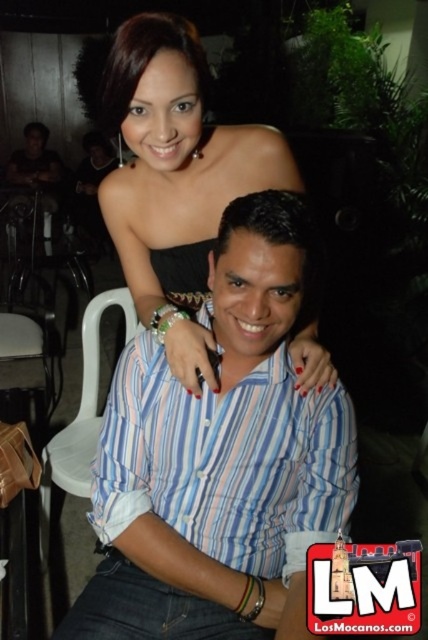
Question: Estimate the real-world distances between objects in this image. Which object is closer to the black woven dress at center?

Choices:
 (A) matte black dress at upper center
 (B) white plastic chair at lower left

Answer: (A)

Question: Considering the relative positions of striped cotton shirt at center and black woven dress at center in the image provided, where is striped cotton shirt at center located with respect to black woven dress at center?

Choices:
 (A) below
 (B) above

Answer: (A)

Question: Does black woven dress at center have a larger size compared to matte black shirt at upper left?

Choices:
 (A) yes
 (B) no

Answer: (B)

Question: Can you confirm if matte black dress at center is positioned below white plastic chair at lower left?

Choices:
 (A) no
 (B) yes

Answer: (A)

Question: Considering the real-world distances, which object is farthest from the matte black dress at center?

Choices:
 (A) striped cotton shirt at center
 (B) white plastic chair at lower left
 (C) matte black shirt at upper left
 (D) matte black dress at upper center

Answer: (C)

Question: Which of these objects is positioned closest to the matte black shirt at upper left?

Choices:
 (A) striped cotton shirt at center
 (B) white plastic chair at lower left
 (C) matte black dress at upper center

Answer: (B)